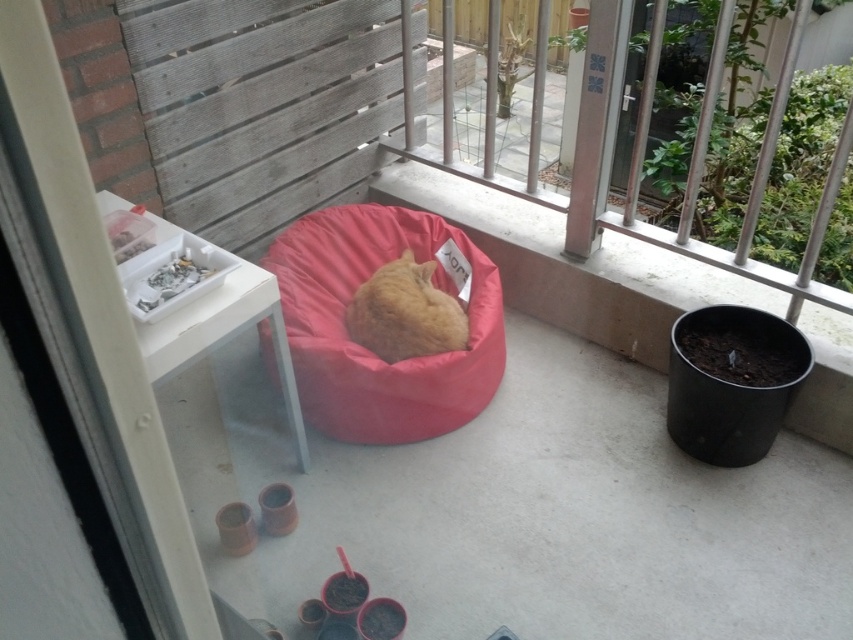
You are a visitor on the balcony and want to sit down on the pink fabric bean bag at center without disturbing the orange soft fur cat at center. Is the cat currently occupying the bean bag?

The orange soft fur cat at center is curled up inside the pink fabric bean bag at center, so the cat is currently occupying the bean bag. You should wait until the cat moves to sit down.

You are standing on the balcony and want to place a small potted plant between the pink fabric bean bag at center and the orange soft fur cat at center. Based on their positions, which side of the bean bag should you place the plant to ensure it is between them?

The pink fabric bean bag at center is to the left of orange soft fur cat at center, so you should place the small potted plant to the right side of the pink fabric bean bag at center to position it between them.